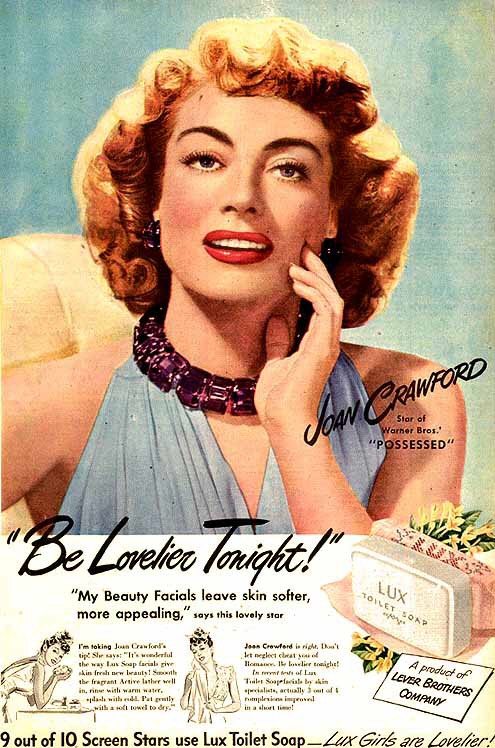
Identify the location of soap. The height and width of the screenshot is (748, 495). (417, 586).